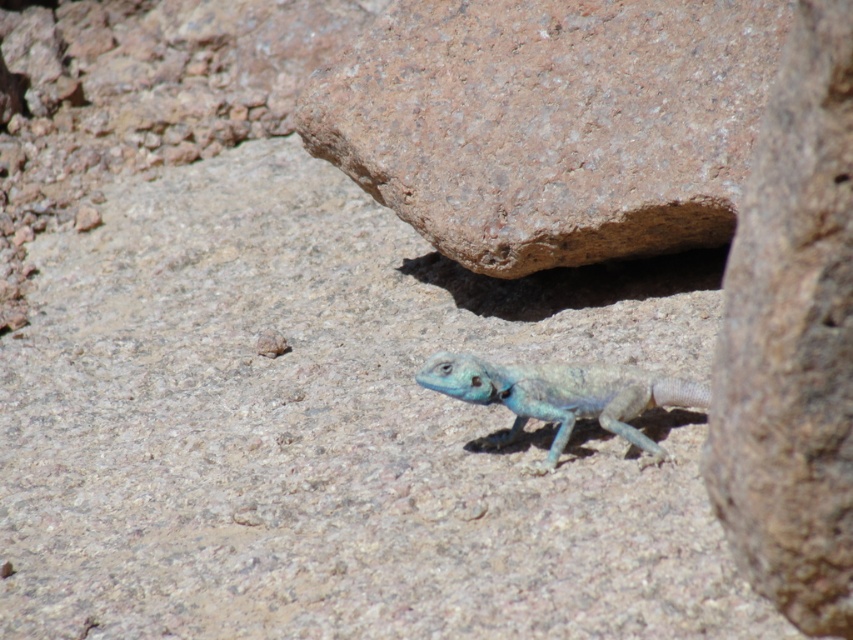
Question: Among these points, which one is nearest to the camera?

Choices:
 (A) (546, 388)
 (B) (769, 147)
 (C) (602, 10)

Answer: (B)

Question: Which object is farther from the camera taking this photo?

Choices:
 (A) brown rough rock at right
 (B) blue-green scaly lizard at center
 (C) rusty stone boulder at upper center

Answer: (C)

Question: Which object is the farthest from the brown rough rock at right?

Choices:
 (A) blue-green scaly lizard at center
 (B) rusty stone boulder at upper center

Answer: (B)

Question: From the image, what is the correct spatial relationship of rusty stone boulder at upper center in relation to blue-green scaly lizard at center?

Choices:
 (A) right
 (B) left

Answer: (B)

Question: Can you confirm if rusty stone boulder at upper center is thinner than blue-green scaly lizard at center?

Choices:
 (A) no
 (B) yes

Answer: (A)

Question: From the image, what is the correct spatial relationship of rusty stone boulder at upper center in relation to brown rough rock at right?

Choices:
 (A) left
 (B) right

Answer: (A)